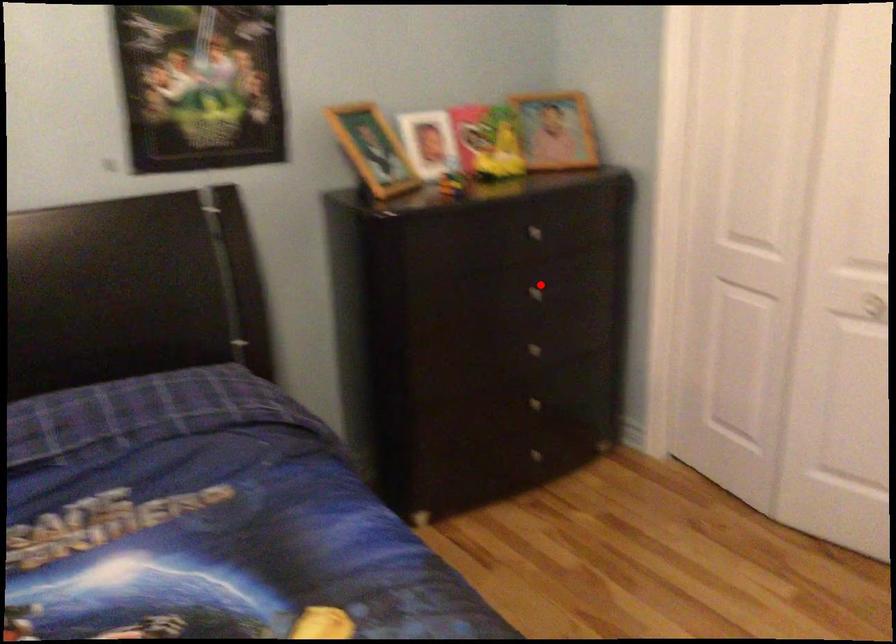
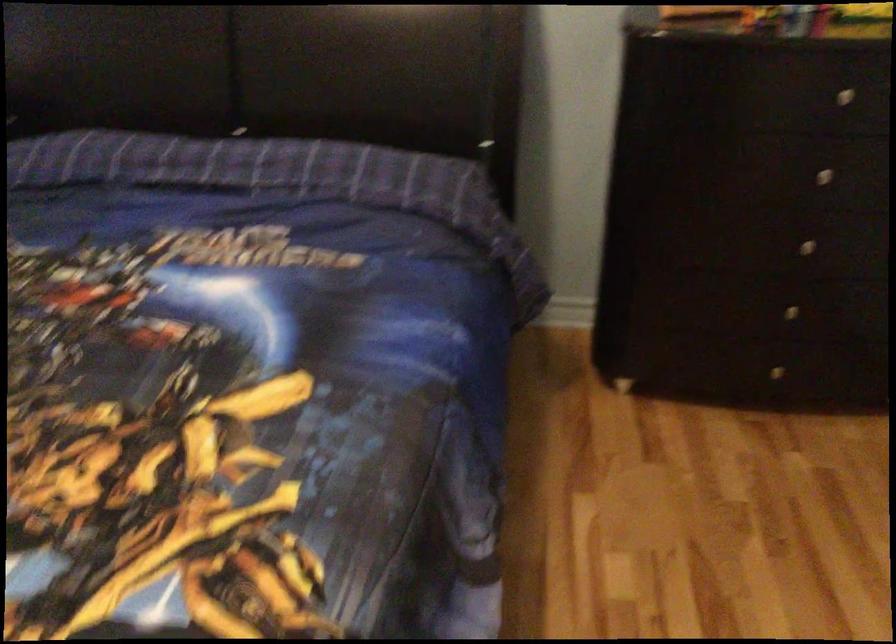
Locate, in the second image, the point that corresponds to the highlighted location in the first image.

(833, 169)